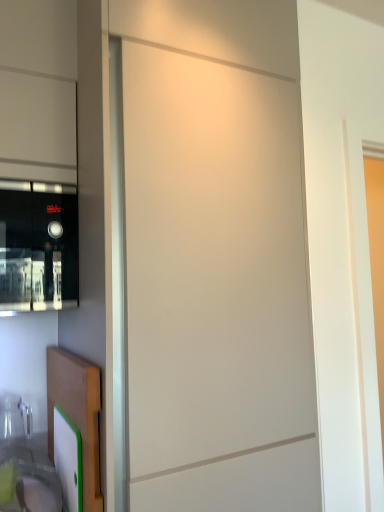
Question: Are black glass microwave at left and translucent plastic sink at lower left making contact?

Choices:
 (A) yes
 (B) no

Answer: (B)

Question: Is black glass microwave at left positioned behind translucent plastic sink at lower left?

Choices:
 (A) yes
 (B) no

Answer: (A)

Question: Can you confirm if black glass microwave at left is wider than translucent plastic sink at lower left?

Choices:
 (A) yes
 (B) no

Answer: (A)

Question: From a real-world perspective, is black glass microwave at left over translucent plastic sink at lower left?

Choices:
 (A) yes
 (B) no

Answer: (A)

Question: Considering the relative positions of black glass microwave at left and translucent plastic sink at lower left in the image provided, is black glass microwave at left to the left of translucent plastic sink at lower left from the viewer's perspective?

Choices:
 (A) no
 (B) yes

Answer: (B)

Question: Does black glass microwave at left come in front of translucent plastic sink at lower left?

Choices:
 (A) yes
 (B) no

Answer: (B)

Question: Considering the relative sizes of black glass microwave at left and wooden cutting board at lower left in the image provided, is black glass microwave at left wider than wooden cutting board at lower left?

Choices:
 (A) yes
 (B) no

Answer: (A)

Question: Could you tell me if black glass microwave at left is facing wooden cutting board at lower left?

Choices:
 (A) yes
 (B) no

Answer: (B)

Question: Considering the relative positions of black glass microwave at left and wooden cutting board at lower left in the image provided, is black glass microwave at left to the right of wooden cutting board at lower left from the viewer's perspective?

Choices:
 (A) no
 (B) yes

Answer: (A)

Question: Would you say black glass microwave at left is outside wooden cutting board at lower left?

Choices:
 (A) yes
 (B) no

Answer: (A)

Question: Can you confirm if black glass microwave at left is smaller than wooden cutting board at lower left?

Choices:
 (A) no
 (B) yes

Answer: (A)

Question: Is black glass microwave at left not close to wooden cutting board at lower left?

Choices:
 (A) no
 (B) yes

Answer: (A)

Question: Is the surface of translucent plastic sink at lower left in direct contact with black glass microwave at left?

Choices:
 (A) yes
 (B) no

Answer: (B)